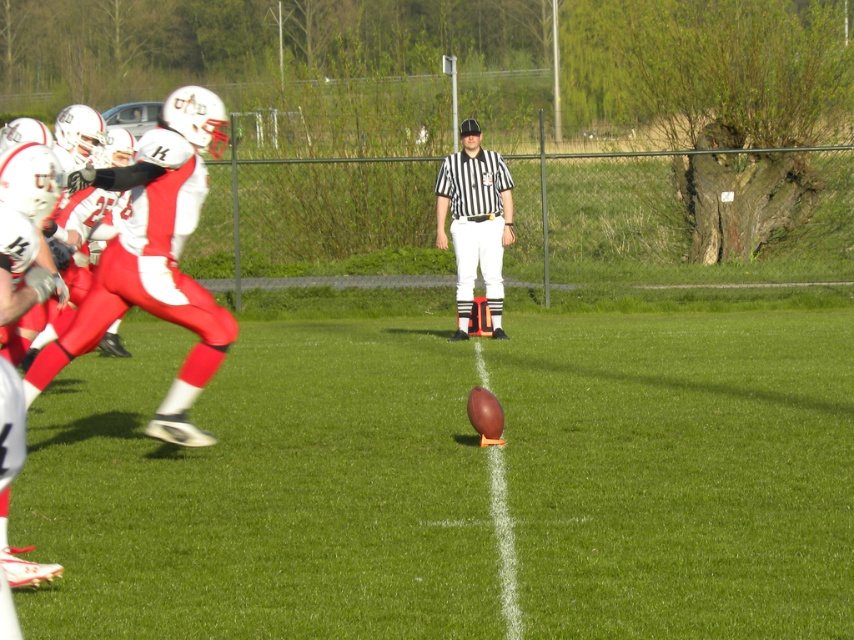
You are a spectator at the football game and notice the white matte uniform at left and the black striped shirt at center. Which of these two items is positioned lower in the image?

The white matte uniform at left is positioned below the black striped shirt at center, so it is lower in the image.

What object is located at the coordinates point (265, 492) in the image?

The point (265, 492) indicates the brown leather football at center.

You are a player trying to determine if you can fit between the brown leather football at center and the black striped shirt at center during the kickoff. Based on their sizes, do you think there is enough space for you to pass through?

The brown leather football at center might be wider than the black striped shirt at center, so there might not be enough space to pass through safely.